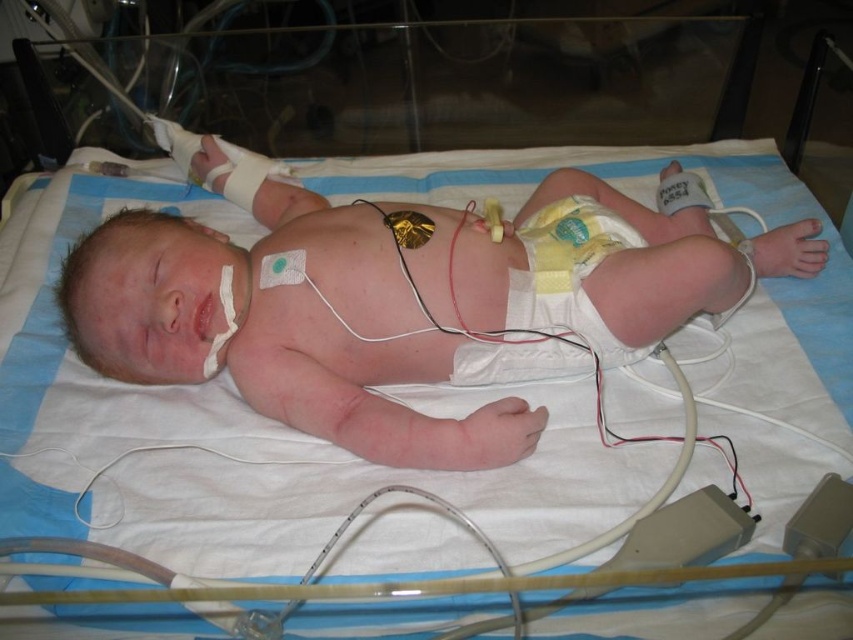
In the hospital scene, there is a newborn baby with pink smooth skin at center and a yellow cloth diaper at center. Which object is positioned higher on the baby?

The pink smooth skin at center is above the yellow cloth diaper at center, so the pink smooth skin at center is positioned higher on the baby.

Based on the photo, looking at the newborn baby in the hospital bed, which object is bigger between the pink smooth skin at center and the yellow cloth diaper at center?

The pink smooth skin at center is larger in size compared to the yellow cloth diaper at center.